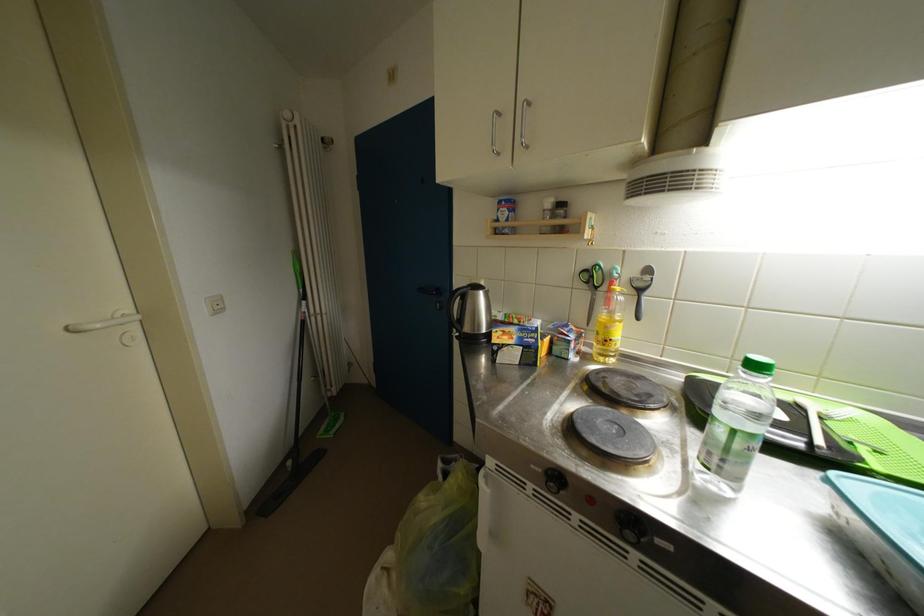
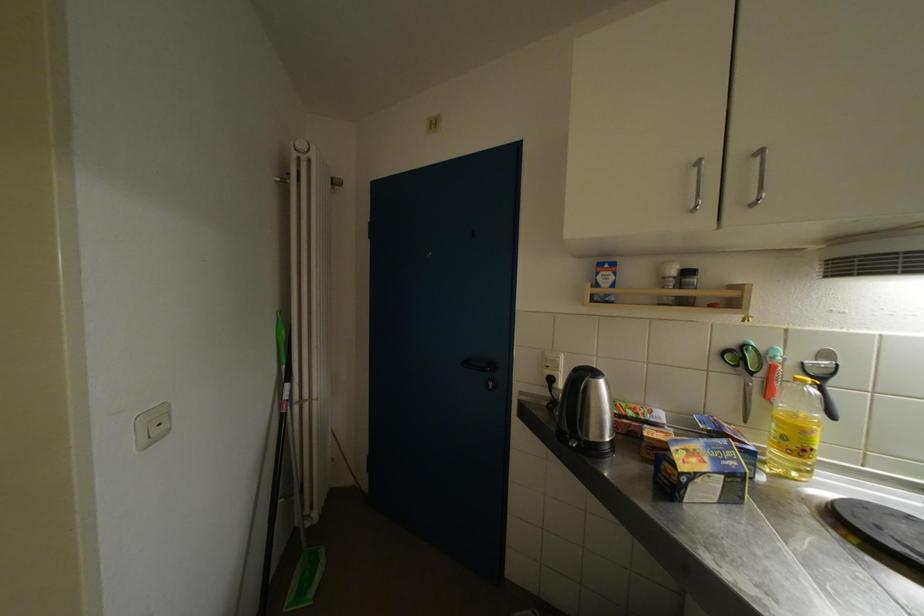
Question: The camera is either moving clockwise (left) or counter-clockwise (right) around the object. The first image is from the beginning of the video and the second image is from the end. Is the camera moving left or right when shooting the video?

Choices:
 (A) Left
 (B) Right

Answer: (A)